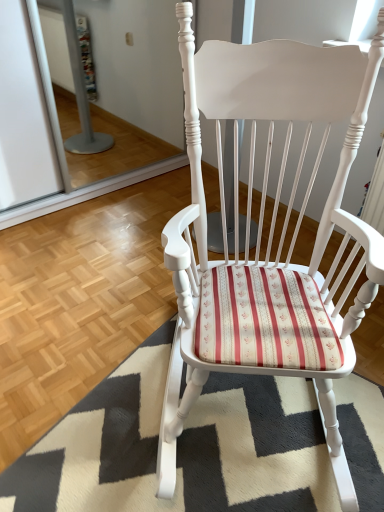
Question: Is white painted wood rocking chair at center looking in the opposite direction of white textured rug at center?

Choices:
 (A) no
 (B) yes

Answer: (A)

Question: Can you confirm if white painted wood rocking chair at center is shorter than white textured rug at center?

Choices:
 (A) no
 (B) yes

Answer: (A)

Question: Can you confirm if white painted wood rocking chair at center is positioned to the right of white textured rug at center?

Choices:
 (A) yes
 (B) no

Answer: (A)

Question: Considering the relative sizes of white painted wood rocking chair at center and white textured rug at center in the image provided, is white painted wood rocking chair at center wider than white textured rug at center?

Choices:
 (A) no
 (B) yes

Answer: (A)

Question: Is white painted wood rocking chair at center next to white textured rug at center?

Choices:
 (A) yes
 (B) no

Answer: (B)

Question: Is white textured rug at center completely or partially inside white painted wood rocking chair at center?

Choices:
 (A) no
 (B) yes

Answer: (A)

Question: Does white textured rug at center come behind white painted wood rocking chair at center?

Choices:
 (A) no
 (B) yes

Answer: (B)

Question: Does white textured rug at center have a greater height compared to white painted wood rocking chair at center?

Choices:
 (A) no
 (B) yes

Answer: (A)

Question: From a real-world perspective, is white textured rug at center physically below white painted wood rocking chair at center?

Choices:
 (A) no
 (B) yes

Answer: (B)

Question: From a real-world perspective, is white textured rug at center physically above white painted wood rocking chair at center?

Choices:
 (A) yes
 (B) no

Answer: (B)

Question: Considering the relative sizes of white textured rug at center and white painted wood rocking chair at center in the image provided, is white textured rug at center bigger than white painted wood rocking chair at center?

Choices:
 (A) yes
 (B) no

Answer: (B)

Question: Does white textured rug at center have a smaller size compared to white painted wood rocking chair at center?

Choices:
 (A) no
 (B) yes

Answer: (B)

Question: In terms of size, does white textured rug at center appear bigger or smaller than white painted wood rocking chair at center?

Choices:
 (A) small
 (B) big

Answer: (A)